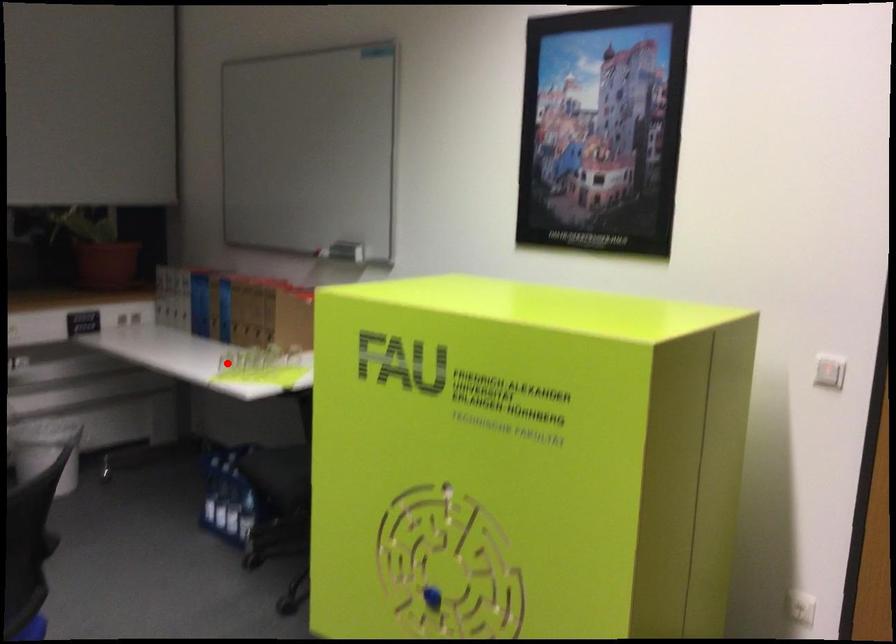
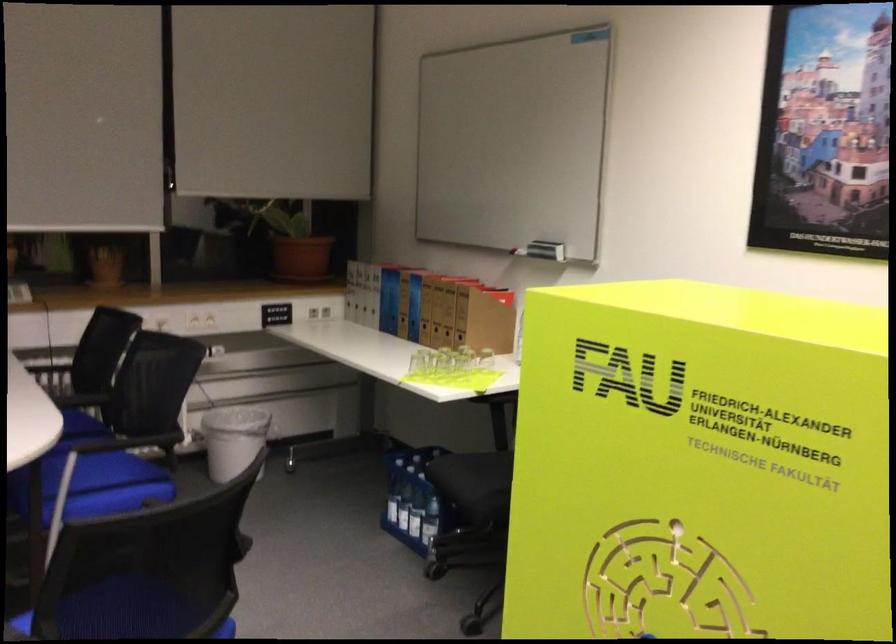
Where in the second image is the point corresponding to the highlighted location from the first image?

(418, 363)